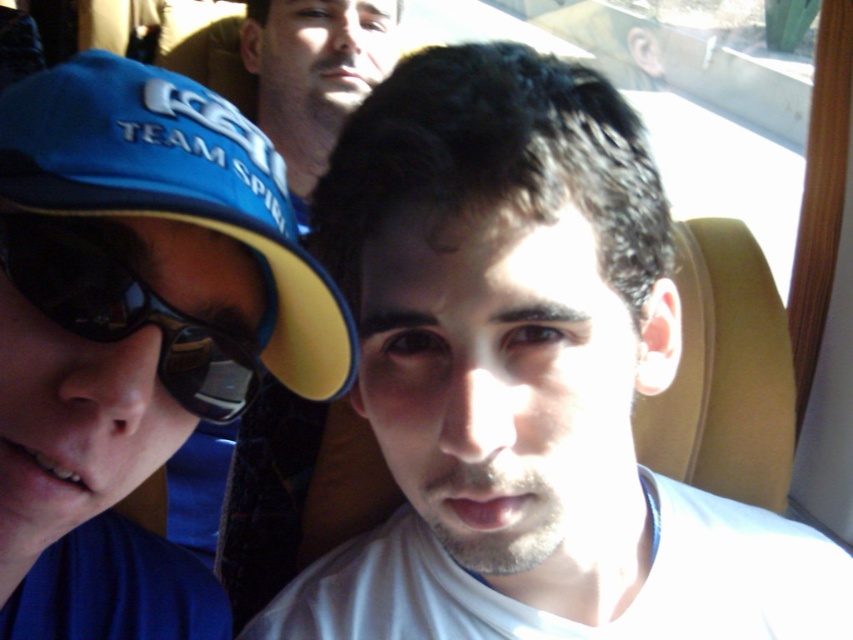
Question: Is blue fabric baseball cap at left smaller than black reflective sunglasses at left?

Choices:
 (A) no
 (B) yes

Answer: (A)

Question: Does blue fabric baseball cap at left appear on the left side of black reflective sunglasses at left?

Choices:
 (A) no
 (B) yes

Answer: (A)

Question: Can you confirm if white matte shirt at center is positioned below matte blue shirt at upper center?

Choices:
 (A) yes
 (B) no

Answer: (A)

Question: Which of the following is the farthest from the observer?

Choices:
 (A) (567, 230)
 (B) (241, 211)
 (C) (192, 376)

Answer: (C)

Question: Among these points, which one is nearest to the camera?

Choices:
 (A) (57, 292)
 (B) (233, 150)

Answer: (A)

Question: Estimate the real-world distances between objects in this image. Which object is farther from the white matte shirt at center?

Choices:
 (A) matte blue shirt at upper center
 (B) blue fabric baseball cap at left
 (C) black reflective sunglasses at left

Answer: (A)